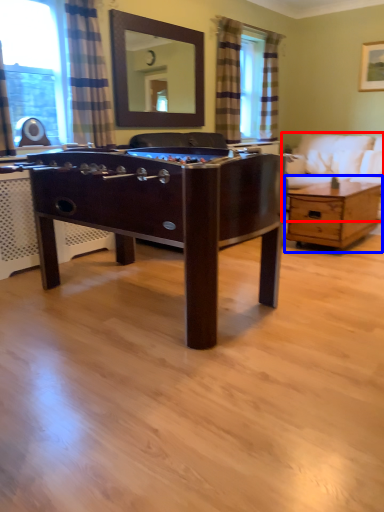
Question: Which of the following is the farthest to the observer, studio couch (highlighted by a red box) or coffee table (highlighted by a blue box)?

Choices:
 (A) studio couch
 (B) coffee table

Answer: (A)